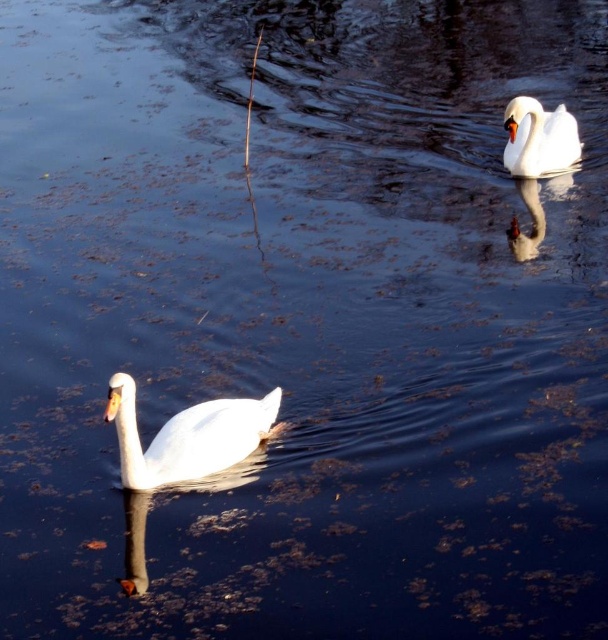
Can you confirm if white glossy swan at lower left is taller than white glossy swan at upper right?

No.

Which is in front, point (223, 428) or point (567, 115)?

Point (223, 428) is in front.

You are a GUI agent. You are given a task and a screenshot of the screen. Output one action in this format:
    pyautogui.click(x=<x>, y=<y>)
    Task: Click on the white glossy swan at lower left
    
    Given the screenshot: What is the action you would take?
    pyautogui.click(x=188, y=435)